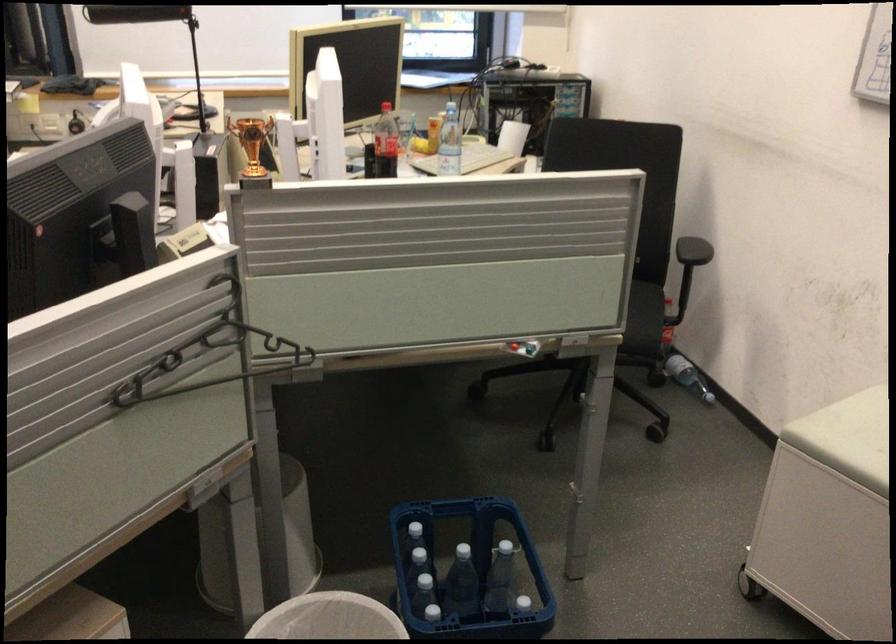
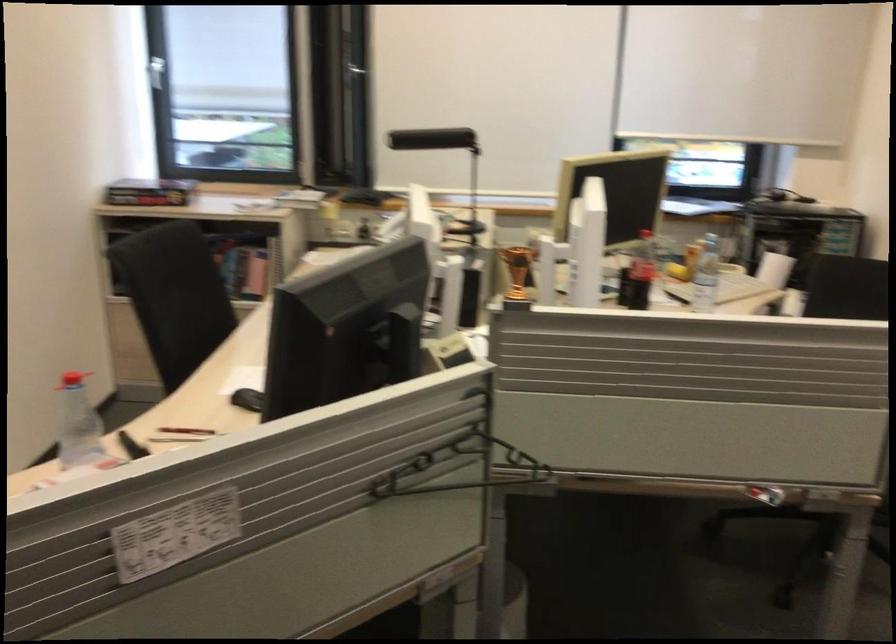
Question: The camera is either moving clockwise (left) or counter-clockwise (right) around the object. The first image is from the beginning of the video and the second image is from the end. Is the camera moving left or right when shooting the video?

Choices:
 (A) Left
 (B) Right

Answer: (B)